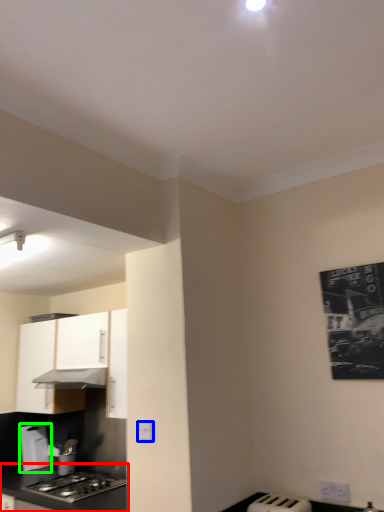
Question: Based on their relative distances, which object is nearer to countertop (highlighted by a red box)? Choose from electric outlet (highlighted by a blue box) and kitchen appliance (highlighted by a green box).

Choices:
 (A) electric outlet
 (B) kitchen appliance

Answer: (B)